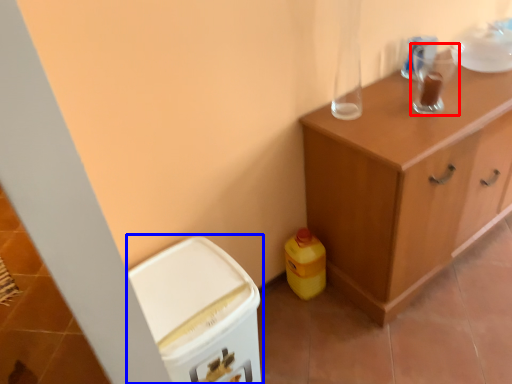
Question: Which object is closer to the camera taking this photo, appliance (highlighted by a red box) or cabinetry (highlighted by a blue box)?

Choices:
 (A) appliance
 (B) cabinetry

Answer: (B)